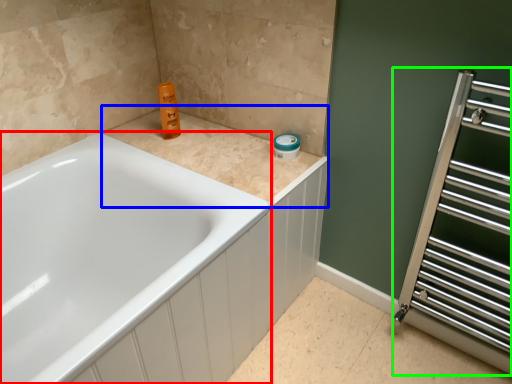
Question: Considering the real-world distances, which object is closest to bathtub (highlighted by a red box)? counter top (highlighted by a blue box) or screen door (highlighted by a green box).

Choices:
 (A) counter top
 (B) screen door

Answer: (A)